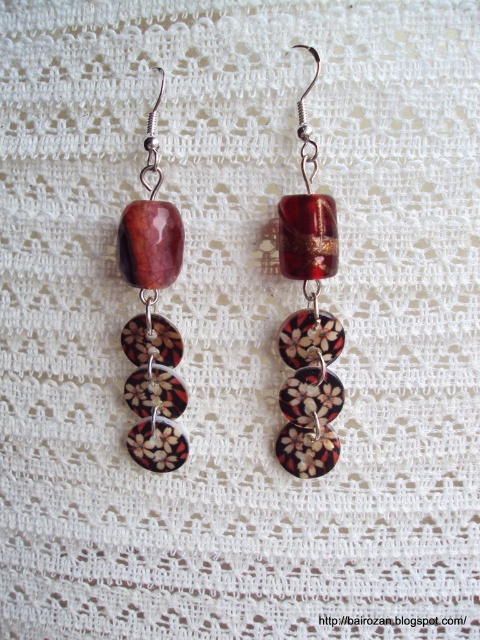
Is matte floral-patterned disc at center thinner than matte brown stone at center?

No, matte floral-patterned disc at center is not thinner than matte brown stone at center.

Consider the image. Is matte floral-patterned disc at center bigger than matte brown stone at center?

Yes.

Find the location of `matte floral-patterned disc at center`. matte floral-patterned disc at center is located at coordinates (309, 317).

Identify the location of matte floral-patterned disc at center. (309, 317).